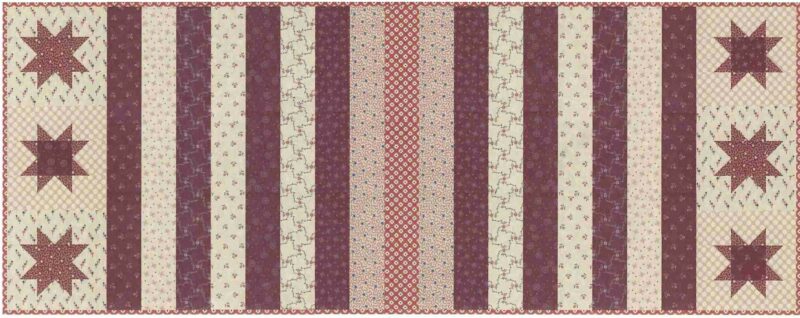
Find the location of a particular element. quilt is located at coordinates (422, 239).